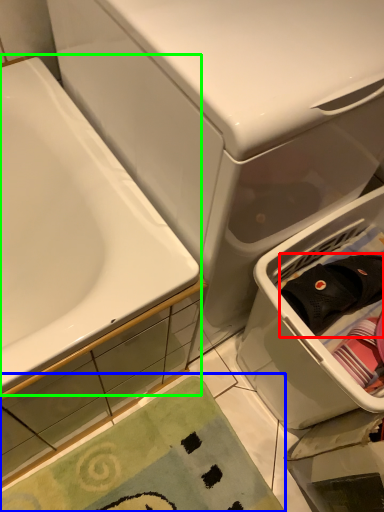
Question: Which is farther away from clothing (highlighted by a red box)? bath mat (highlighted by a blue box) or bathtub (highlighted by a green box)?

Choices:
 (A) bath mat
 (B) bathtub

Answer: (A)